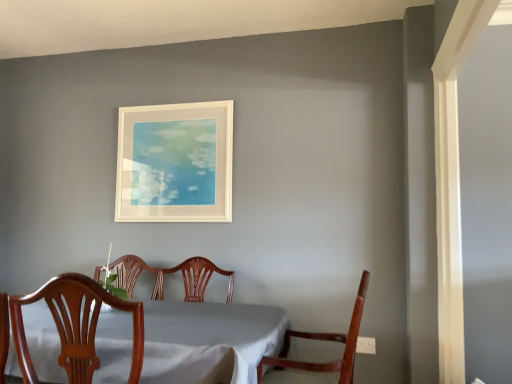
Question: Is the surface of mahogany wood chair at lower right, which is the first chair in right-to-left order, in direct contact with wooden chair at center, marked as the second chair in a right-to-left arrangement?

Choices:
 (A) yes
 (B) no

Answer: (B)

Question: Is mahogany wood chair at lower right, which is the first chair in right-to-left order, located outside wooden chair at center, which appears as the first chair when viewed from the left?

Choices:
 (A) yes
 (B) no

Answer: (A)

Question: Can you confirm if mahogany wood chair at lower right, which is the first chair in right-to-left order, is thinner than wooden chair at center, marked as the second chair in a right-to-left arrangement?

Choices:
 (A) no
 (B) yes

Answer: (B)

Question: Considering the relative sizes of mahogany wood chair at lower right, which is the first chair in right-to-left order, and wooden chair at center, which appears as the first chair when viewed from the left, in the image provided, is mahogany wood chair at lower right, which is the first chair in right-to-left order, shorter than wooden chair at center, which appears as the first chair when viewed from the left,?

Choices:
 (A) no
 (B) yes

Answer: (A)

Question: Is mahogany wood chair at lower right, the 2th chair viewed from the left, to the left of wooden chair at center, marked as the second chair in a right-to-left arrangement, from the viewer's perspective?

Choices:
 (A) no
 (B) yes

Answer: (A)

Question: Is wooden chair at center, marked as the second chair in a right-to-left arrangement, inside mahogany wood chair at lower right, which is the first chair in right-to-left order?

Choices:
 (A) no
 (B) yes

Answer: (A)

Question: Does white matte picture frame at upper center have a greater width compared to white cloth-covered table at center?

Choices:
 (A) yes
 (B) no

Answer: (B)

Question: Is white cloth-covered table at center at the back of white matte picture frame at upper center?

Choices:
 (A) no
 (B) yes

Answer: (A)

Question: Is white matte picture frame at upper center bigger than white cloth-covered table at center?

Choices:
 (A) yes
 (B) no

Answer: (B)

Question: Is white matte picture frame at upper center smaller than white cloth-covered table at center?

Choices:
 (A) yes
 (B) no

Answer: (A)

Question: Would you say white matte picture frame at upper center is outside white cloth-covered table at center?

Choices:
 (A) yes
 (B) no

Answer: (A)

Question: Does white matte picture frame at upper center have a lesser height compared to white cloth-covered table at center?

Choices:
 (A) no
 (B) yes

Answer: (A)

Question: Does mahogany wood chair at lower right, the 2th chair viewed from the left, have a greater height compared to white matte picture frame at upper center?

Choices:
 (A) yes
 (B) no

Answer: (B)